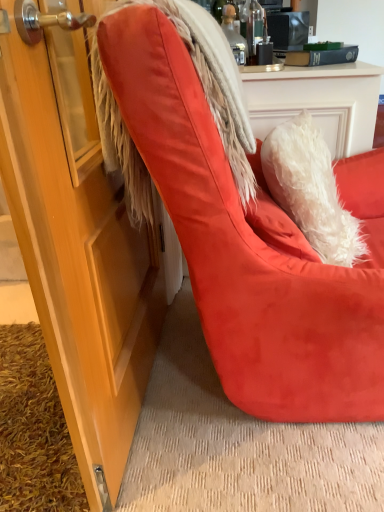
Question: Considering the relative sizes of fuzzy white fur coat at upper right and suede orange chair at center in the image provided, is fuzzy white fur coat at upper right smaller than suede orange chair at center?

Choices:
 (A) yes
 (B) no

Answer: (A)

Question: Is suede orange chair at center completely or partially inside fuzzy white fur coat at upper right?

Choices:
 (A) no
 (B) yes

Answer: (A)

Question: Is fuzzy white fur coat at upper right outside of suede orange chair at center?

Choices:
 (A) no
 (B) yes

Answer: (A)

Question: From a real-world perspective, is fuzzy white fur coat at upper right over suede orange chair at center?

Choices:
 (A) yes
 (B) no

Answer: (A)

Question: Is fuzzy white fur coat at upper right shorter than suede orange chair at center?

Choices:
 (A) no
 (B) yes

Answer: (B)

Question: From the image's perspective, is fuzzy white fur coat at upper right beneath suede orange chair at center?

Choices:
 (A) yes
 (B) no

Answer: (B)

Question: Considering the relative positions of suede orange chair at center and fuzzy white fur coat at upper right in the image provided, is suede orange chair at center to the right of fuzzy white fur coat at upper right from the viewer's perspective?

Choices:
 (A) no
 (B) yes

Answer: (B)

Question: Is suede orange chair at center smaller than fuzzy white fur coat at upper right?

Choices:
 (A) yes
 (B) no

Answer: (B)

Question: Is suede orange chair at center outside of fuzzy white fur coat at upper right?

Choices:
 (A) yes
 (B) no

Answer: (A)

Question: Are suede orange chair at center and fuzzy white fur coat at upper right beside each other?

Choices:
 (A) no
 (B) yes

Answer: (A)

Question: Does suede orange chair at center come in front of fuzzy white fur coat at upper right?

Choices:
 (A) yes
 (B) no

Answer: (A)

Question: Considering the relative sizes of suede orange chair at center and fuzzy white fur coat at upper right in the image provided, is suede orange chair at center taller than fuzzy white fur coat at upper right?

Choices:
 (A) yes
 (B) no

Answer: (A)

Question: From the image's perspective, is suede orange chair at center above or below fuzzy white fur coat at upper right?

Choices:
 (A) above
 (B) below

Answer: (B)